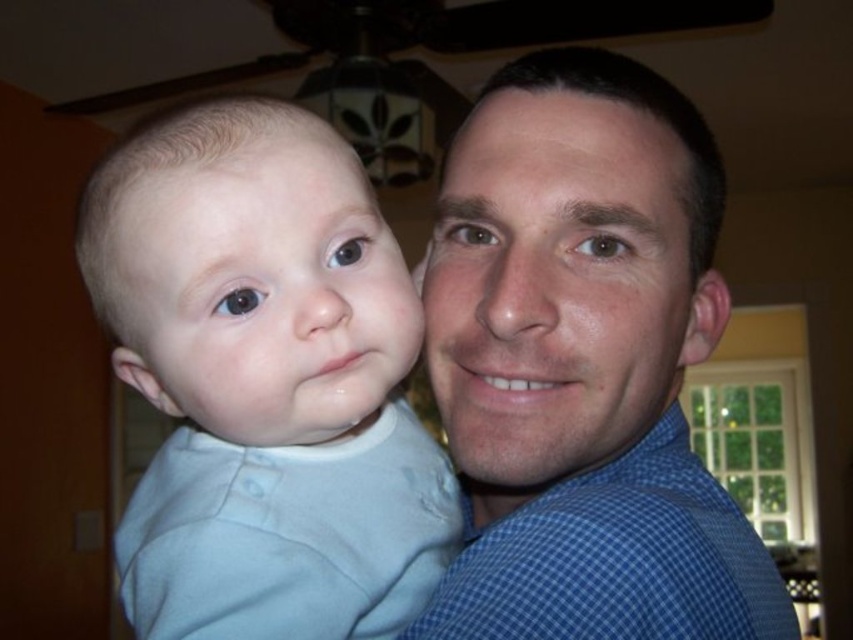
Question: Which object is the closest to the blue checkered shirt at center?

Choices:
 (A) smooth blue shirt at right
 (B) smooth skin baby at left

Answer: (A)

Question: Which is nearer to the blue checkered shirt at right?

Choices:
 (A) blue checkered shirt at center
 (B) smooth skin baby at left

Answer: (A)

Question: Is smooth blue shirt at right thinner than blue checkered shirt at right?

Choices:
 (A) no
 (B) yes

Answer: (B)

Question: Which object appears farthest from the camera in this image?

Choices:
 (A) smooth blue shirt at right
 (B) blue checkered shirt at center

Answer: (A)

Question: Is smooth blue shirt at right behind smooth skin baby at left?

Choices:
 (A) yes
 (B) no

Answer: (A)

Question: Does light blue fabric baby at center have a lesser width compared to smooth skin baby at left?

Choices:
 (A) no
 (B) yes

Answer: (A)